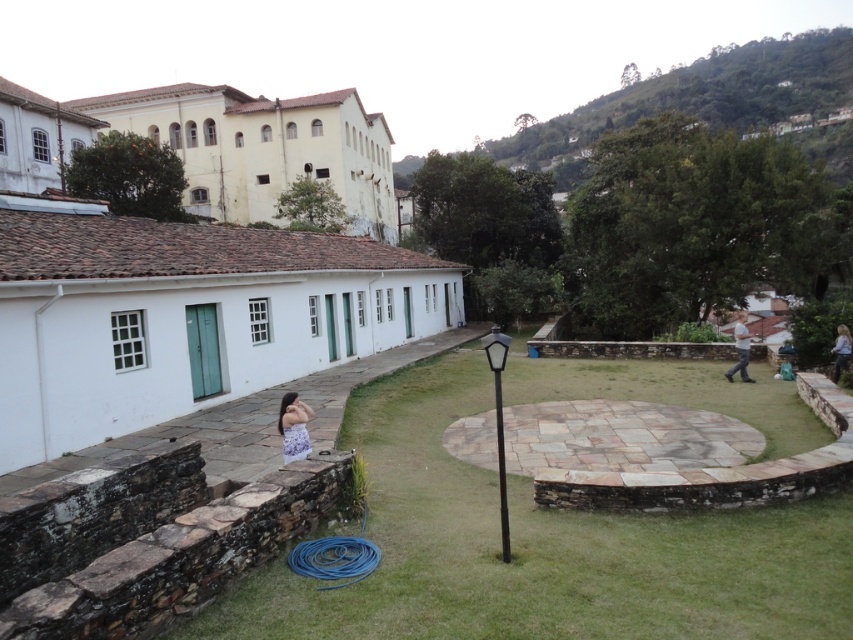
Based on the photo, you are at a garden party and see two dresses on the ground. The floral dress at lower center and the light blue denim dress at lower right. Which dress is shorter?

The floral dress at lower center is shorter than the light blue denim dress at lower right.

You are planning to place a bench between the floral dress at lower center and the light blue denim dress at lower right. The bench is 1.5 meters long. Will there be enough space to place the bench between them?

The floral dress at lower center and the light blue denim dress at lower right are 13.81 meters apart, so yes, there is enough space to place a 1.5 meter long bench between them.